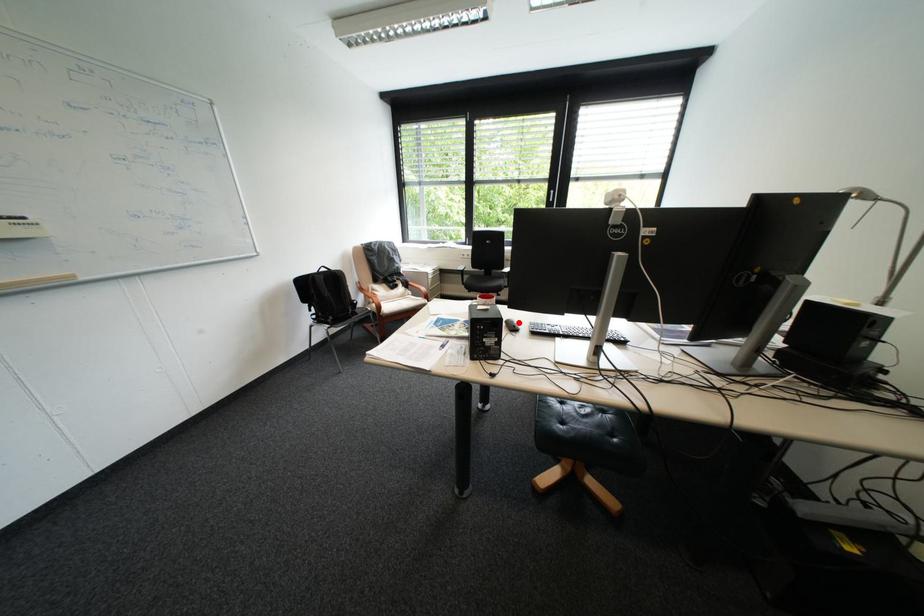
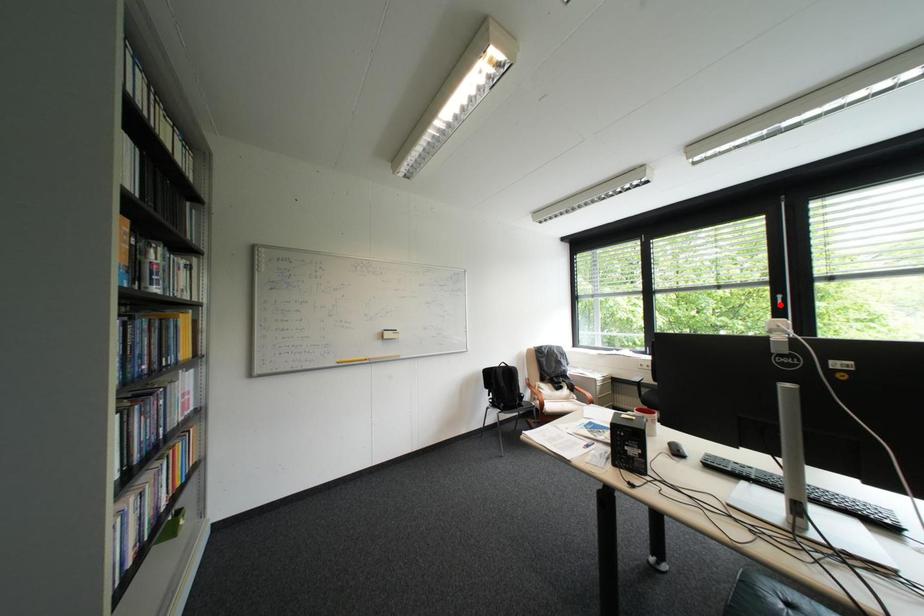
I am providing you with two images of the same scene from different viewpoints. A red point is marked on the first image and another point is marked on the second image. Are the points marked in image1 and image2 representing the same 3D position?

No